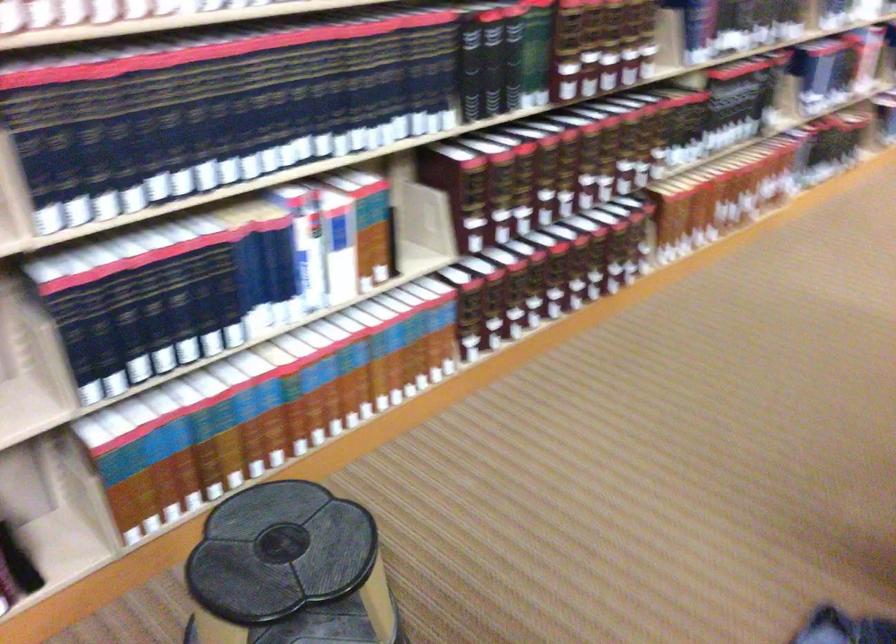
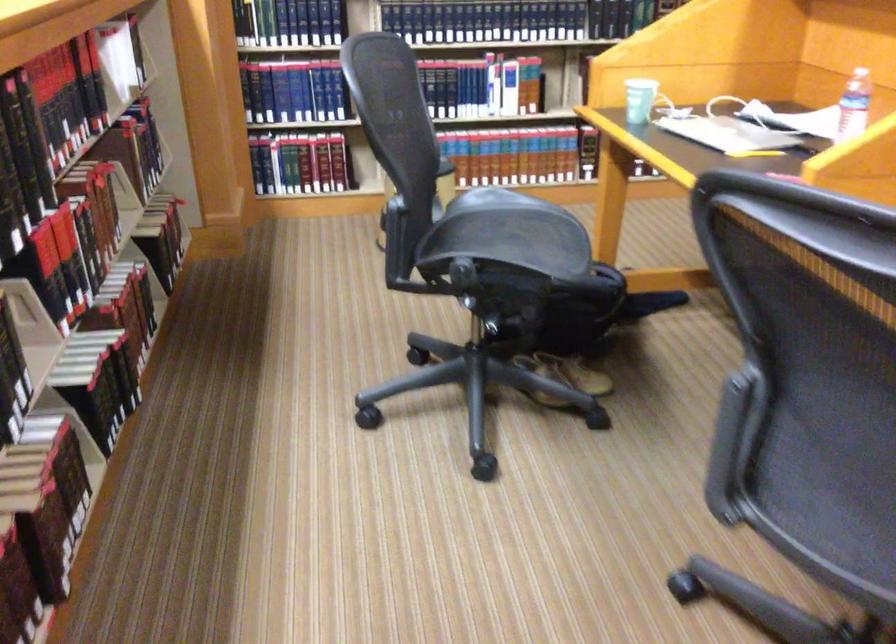
Question: I am providing you with two images of the same scene from different viewpoints. Which of the following objects are not visible in image2?

Choices:
 (A) decorative throw pillow
 (B) chair armrest
 (C) chair sitting surface
 (D) black spine book

Answer: (D)